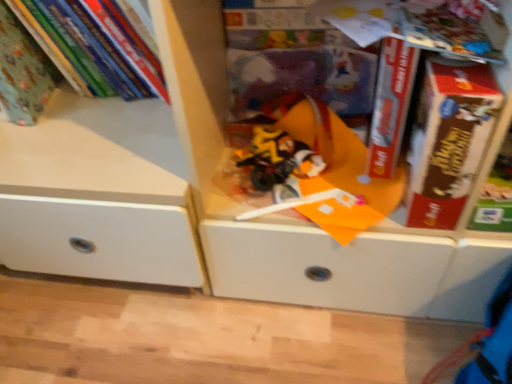
Question: Considering the relative positions of translucent plastic toy at center and matte green book at upper left, arranged as the 2th book when viewed from the left, in the image provided, is translucent plastic toy at center to the left or to the right of matte green book at upper left, arranged as the 2th book when viewed from the left,?

Choices:
 (A) left
 (B) right

Answer: (B)

Question: Considering the positions of point (269, 185) and point (93, 66), is point (269, 185) closer or farther from the camera than point (93, 66)?

Choices:
 (A) closer
 (B) farther

Answer: (A)

Question: Which of these objects is positioned closest to the red matte book at center, the 1th paperback book in the left-to-right sequence?

Choices:
 (A) matte green book at upper left, the first book from the left
 (B) matte green book at upper left, which is the 1th book from right to left
 (C) translucent plastic toy at center
 (D) brown cardboard book at right, placed as the second paperback book when sorted from left to right

Answer: (D)

Question: Considering the real-world distances, which object is closest to the matte green book at upper left, which is the 1th book from right to left?

Choices:
 (A) matte green book at upper left, the first book from the left
 (B) red matte book at center, the 1th paperback book in the left-to-right sequence
 (C) brown cardboard book at right, placed as the second paperback book when sorted from left to right
 (D) translucent plastic toy at center

Answer: (A)